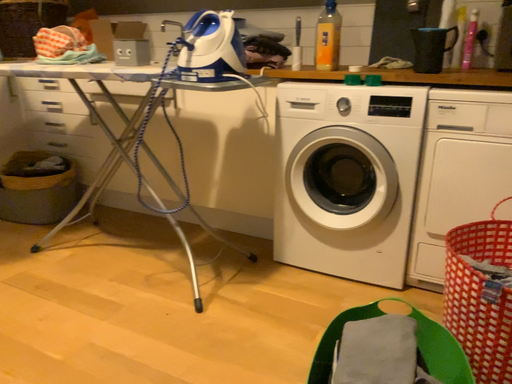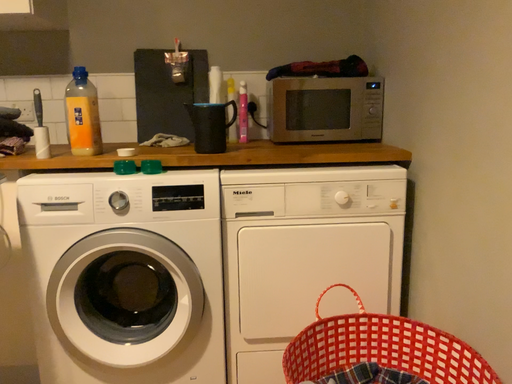
Question: How did the camera likely rotate when shooting the video?

Choices:
 (A) rotated upward
 (B) rotated downward

Answer: (A)